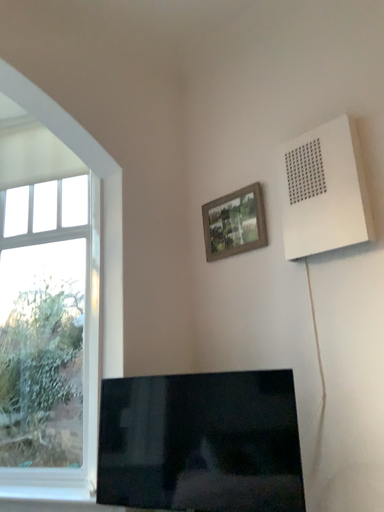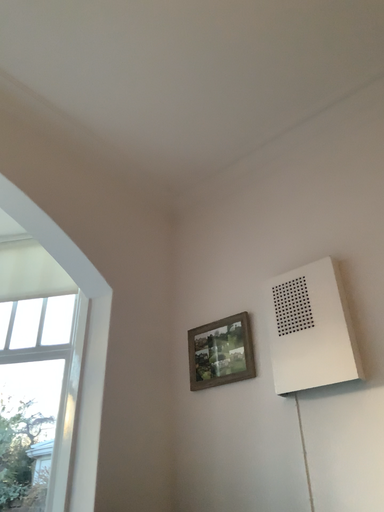
Question: How did the camera likely rotate when shooting the video?

Choices:
 (A) rotated upward
 (B) rotated downward

Answer: (A)